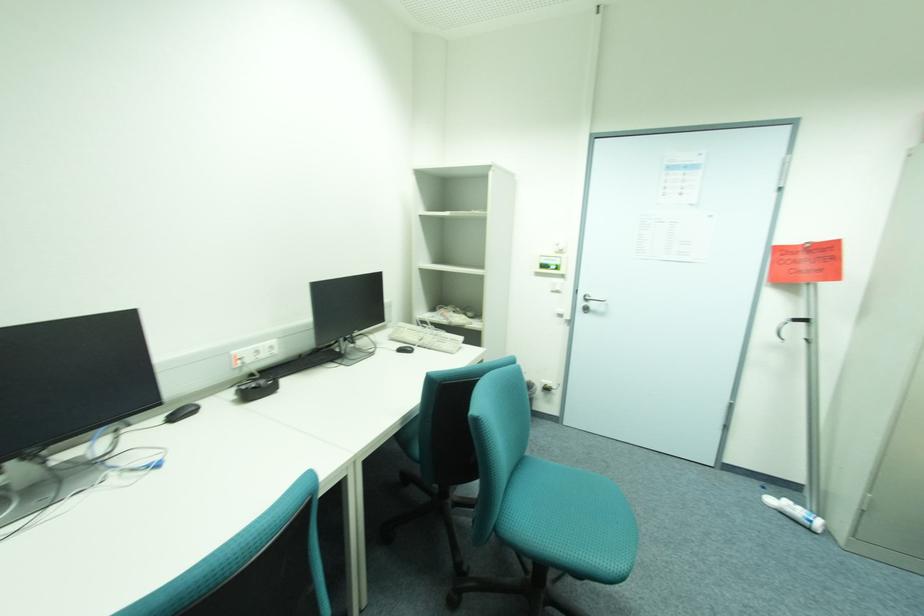
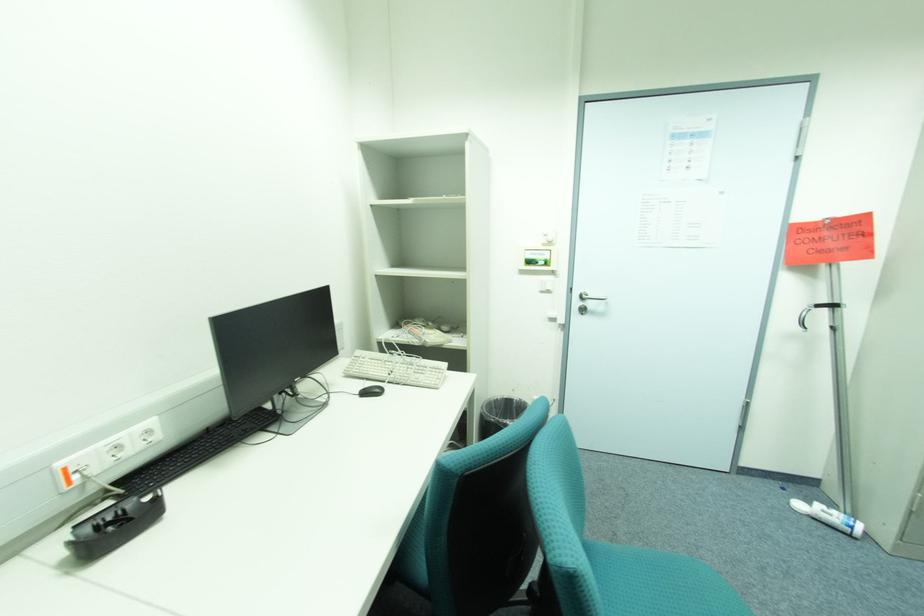
Question: What movement of the cameraman would produce the second image?

Choices:
 (A) Left
 (B) Right
 (C) Forward
 (D) Backward

Answer: (C)